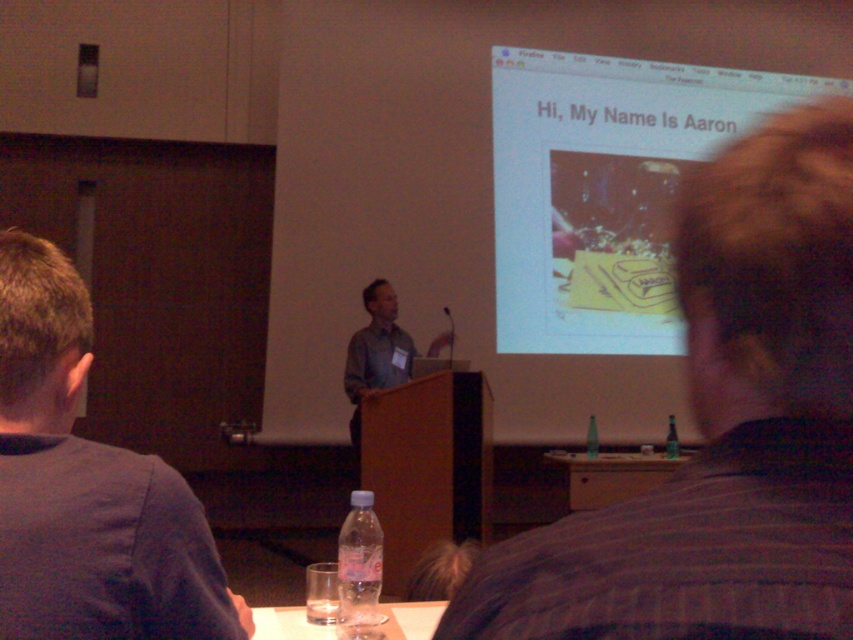
Based on the scene description, if the gray shirt at center and the green glass bottle at right are both visible in the image, which object would likely be closer to the camera?

The gray shirt at center is bigger than the green glass bottle at right, so the gray shirt at center is closer to the camera.

You are a presenter standing at the podium in the conference room. You need to reach the green glass bottle at right quickly. Based on the coordinates provided, in which direction should you move to get it?

The green glass bottle at right is located at coordinates point (671, 438). To reach it, you should move to the right side of the podium since the bottle is positioned at the right side of the scene.

You are sitting at the table with the water bottle and glass. You want to hand a document to the person in the striped shirt at upper right. Which direction should you move to reach them?

The striped shirt at upper right is located at point 0.670 on the x axis and 0.849 on the y axis, so you should move towards the upper right direction to reach them.